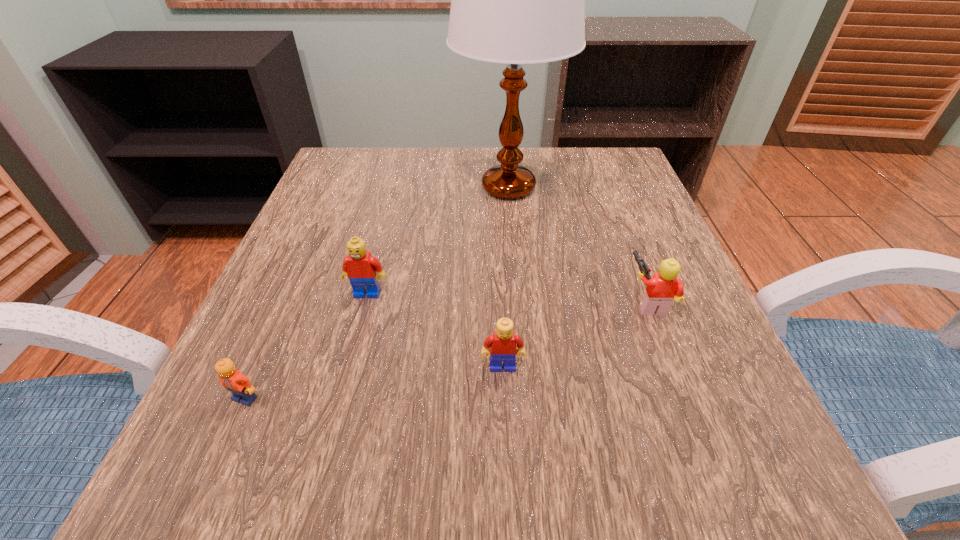
Where is `table lamp`? The height and width of the screenshot is (540, 960). table lamp is located at coordinates (516, 0).

This screenshot has height=540, width=960. What are the coordinates of `the farthest object` in the screenshot? It's located at (516, 0).

Locate an element on the screen. The width and height of the screenshot is (960, 540). the second Lego from left to right is located at coordinates (362, 269).

The height and width of the screenshot is (540, 960). What are the coordinates of `the rightmost object` in the screenshot? It's located at (664, 287).

Where is `the fourth farthest object`? the fourth farthest object is located at coordinates (502, 344).

Identify the location of the third Lego from left to right. (502, 344).

You are a GUI agent. You are given a task and a screenshot of the screen. Output one action in this format:
    pyautogui.click(x=<x>, y=<y>)
    Task: Click on the nearest object
    This screenshot has height=540, width=960.
    Given the screenshot: What is the action you would take?
    pyautogui.click(x=233, y=380)

Identify the location of the nearest Lego. (233, 380).

In order to click on vacant space located 0.200m on the front of the table lamp in this screenshot , I will do `click(517, 286)`.

This screenshot has height=540, width=960. In order to click on vacant area located on the face of the second Lego from left to right in this screenshot , I will do `click(343, 384)`.